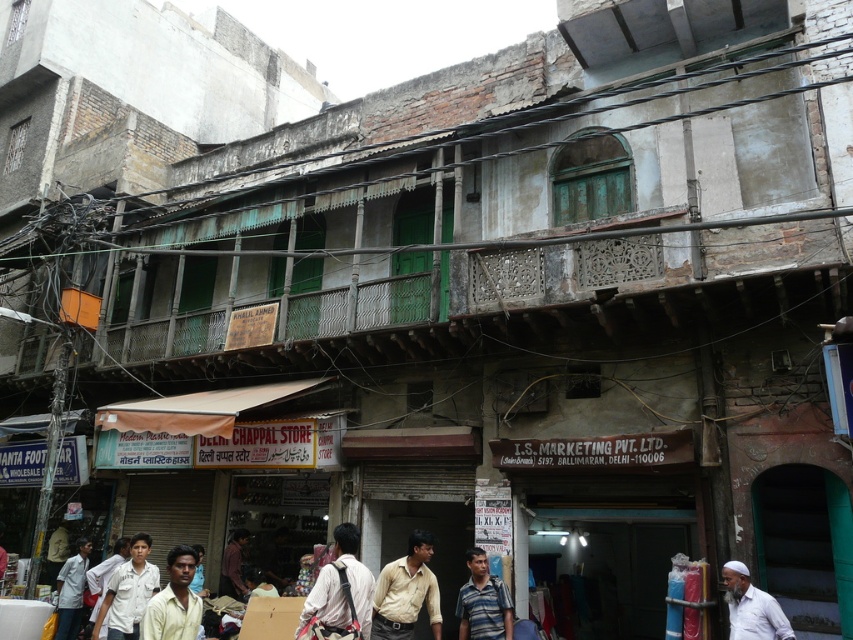
Does point (483, 556) come behind point (737, 563)?

Yes, point (483, 556) is behind point (737, 563).

Is striped cotton shirt at lower center to the right of white cotton beard at lower right from the viewer's perspective?

Incorrect, striped cotton shirt at lower center is not on the right side of white cotton beard at lower right.

Locate an element on the screen. The height and width of the screenshot is (640, 853). striped cotton shirt at lower center is located at coordinates (483, 602).

Does white cotton beard at lower right have a smaller size compared to dark brown shirt at center?

Correct, white cotton beard at lower right occupies less space than dark brown shirt at center.

Can you confirm if white cotton beard at lower right is positioned to the right of dark brown shirt at center?

Yes, white cotton beard at lower right is to the right of dark brown shirt at center.

The height and width of the screenshot is (640, 853). Describe the element at coordinates (751, 608) in the screenshot. I see `white cotton beard at lower right` at that location.

Find the location of a particular element. The image size is (853, 640). white cotton beard at lower right is located at coordinates (751, 608).

Does light brown shirt at lower left have a lesser width compared to striped cotton shirt at lower center?

Yes, light brown shirt at lower left is thinner than striped cotton shirt at lower center.

How distant is light brown shirt at lower left from striped cotton shirt at lower center?

A distance of 3.45 meters exists between light brown shirt at lower left and striped cotton shirt at lower center.

Does point (148, 604) lie in front of point (508, 636)?

That is True.

At what (x,y) coordinates should I click in order to perform the action: click on light brown shirt at lower left. Please return your answer as a coordinate pair (x, y). This screenshot has width=853, height=640. Looking at the image, I should click on (173, 600).